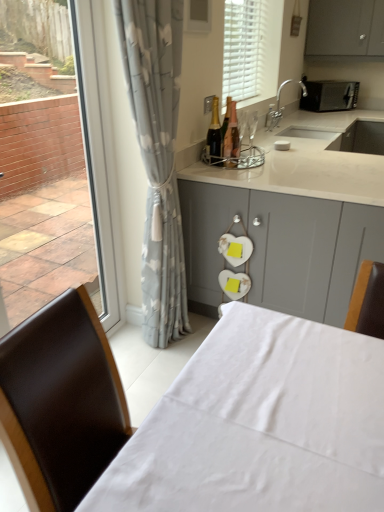
Question: Is the surface of shiny gold bottle at center, the 2th bottle when ordered from left to right, in direct contact with gray floral curtain at left?

Choices:
 (A) no
 (B) yes

Answer: (A)

Question: From the image's perspective, does shiny gold bottle at center, marked as the 1th bottle in a right-to-left arrangement, appear lower than gray floral curtain at left?

Choices:
 (A) no
 (B) yes

Answer: (A)

Question: Is shiny gold bottle at center, marked as the 1th bottle in a right-to-left arrangement, smaller than gray floral curtain at left?

Choices:
 (A) no
 (B) yes

Answer: (B)

Question: Is shiny gold bottle at center, marked as the 1th bottle in a right-to-left arrangement, at the right side of gray floral curtain at left?

Choices:
 (A) no
 (B) yes

Answer: (B)

Question: Can you confirm if shiny gold bottle at center, marked as the 1th bottle in a right-to-left arrangement, is bigger than gray floral curtain at left?

Choices:
 (A) no
 (B) yes

Answer: (A)

Question: Considering the positions of shiny gold champagne bottle at center, which ranks as the second bottle in right-to-left order, and shiny gold bottle at center, marked as the 1th bottle in a right-to-left arrangement, in the image, is shiny gold champagne bottle at center, which ranks as the second bottle in right-to-left order, taller or shorter than shiny gold bottle at center, marked as the 1th bottle in a right-to-left arrangement,?

Choices:
 (A) tall
 (B) short

Answer: (B)

Question: From a real-world perspective, is shiny gold champagne bottle at center, placed as the 1th bottle when sorted from left to right, physically located above or below shiny gold bottle at center, marked as the 1th bottle in a right-to-left arrangement?

Choices:
 (A) above
 (B) below

Answer: (B)

Question: Is shiny gold champagne bottle at center, which ranks as the second bottle in right-to-left order, to the left or to the right of shiny gold bottle at center, marked as the 1th bottle in a right-to-left arrangement, in the image?

Choices:
 (A) right
 (B) left

Answer: (B)

Question: Relative to shiny gold bottle at center, marked as the 1th bottle in a right-to-left arrangement, is shiny gold champagne bottle at center, placed as the 1th bottle when sorted from left to right, in front or behind?

Choices:
 (A) behind
 (B) front

Answer: (B)

Question: Considering the positions of black matte microwave at upper right and white matte blinds at upper center in the image, is black matte microwave at upper right wider or thinner than white matte blinds at upper center?

Choices:
 (A) thin
 (B) wide

Answer: (B)

Question: Is point (317, 87) positioned closer to the camera than point (271, 26)?

Choices:
 (A) closer
 (B) farther

Answer: (B)

Question: Is black matte microwave at upper right taller or shorter than white matte blinds at upper center?

Choices:
 (A) tall
 (B) short

Answer: (B)

Question: Is black matte microwave at upper right bigger or smaller than white matte blinds at upper center?

Choices:
 (A) small
 (B) big

Answer: (A)

Question: Based on their sizes in the image, would you say gray floral curtain at left is bigger or smaller than white matte blinds at upper center?

Choices:
 (A) big
 (B) small

Answer: (A)

Question: In the image, is gray floral curtain at left positioned in front of or behind white matte blinds at upper center?

Choices:
 (A) front
 (B) behind

Answer: (A)